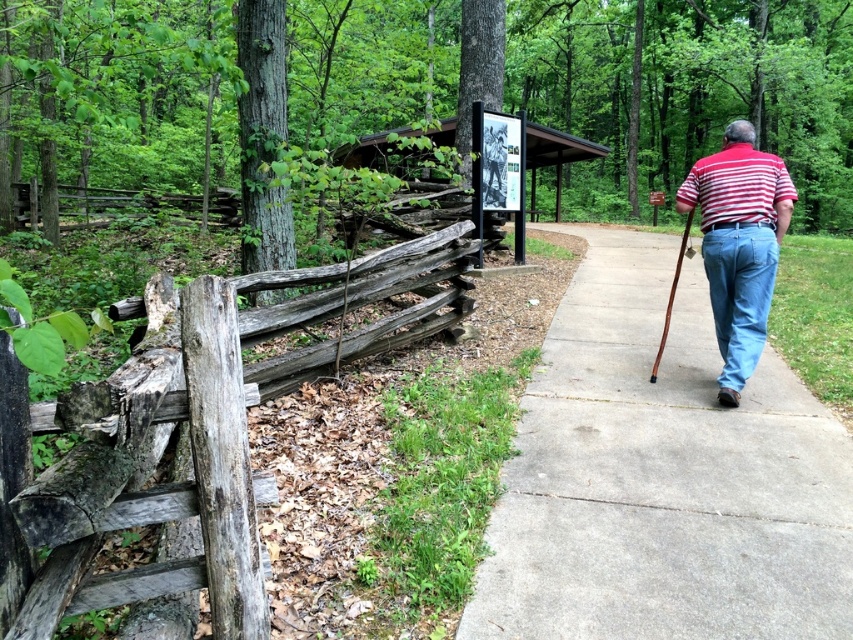
Can you confirm if weathered wood fence at left is bigger than striped cotton shirt at right?

Indeed, weathered wood fence at left has a larger size compared to striped cotton shirt at right.

In the scene shown: Who is more distant from viewer, (91, 397) or (724, 397)?

Point (724, 397)

Identify the location of weathered wood fence at left. The height and width of the screenshot is (640, 853). (207, 433).

Is concrete sidewalk at center wider than striped cotton shirt at right?

Correct, the width of concrete sidewalk at center exceeds that of striped cotton shirt at right.

Who is taller, concrete sidewalk at center or striped cotton shirt at right?

striped cotton shirt at right

The width and height of the screenshot is (853, 640). Describe the element at coordinates (662, 476) in the screenshot. I see `concrete sidewalk at center` at that location.

Where is `concrete sidewalk at center`? concrete sidewalk at center is located at coordinates (662, 476).

Does weathered wood fence at left appear on the left side of light blue denim jeans at right?

Yes, weathered wood fence at left is to the left of light blue denim jeans at right.

Can you confirm if weathered wood fence at left is thinner than light blue denim jeans at right?

No.

What are the coordinates of `weathered wood fence at left` in the screenshot? It's located at (207, 433).